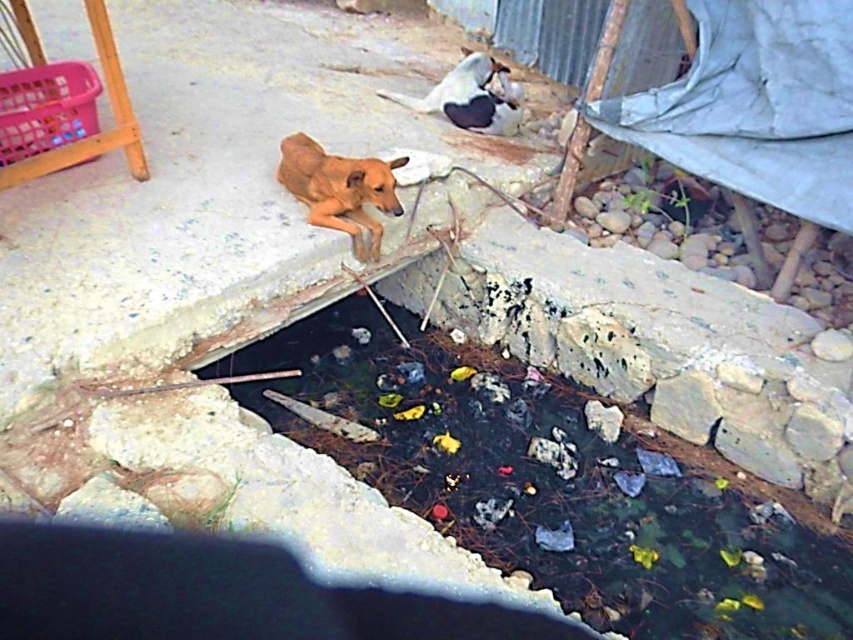
Consider the image. Which is more to the left, black stone puddle at center or brown furry dog at center?

Positioned to the left is brown furry dog at center.

How much distance is there between black stone puddle at center and brown furry dog at center?

They are 3.86 feet apart.

Measure the distance between black stone puddle at center and camera.

black stone puddle at center is 9.15 feet away from camera.

Where is `black stone puddle at center`? The height and width of the screenshot is (640, 853). black stone puddle at center is located at coordinates (548, 481).

Who is lower down, brown furry dog at center or white fur dog at upper center?

brown furry dog at center is below.

Between brown furry dog at center and white fur dog at upper center, which one appears on the left side from the viewer's perspective?

brown furry dog at center is more to the left.

This screenshot has width=853, height=640. What do you see at coordinates (339, 189) in the screenshot?
I see `brown furry dog at center` at bounding box center [339, 189].

Where is `brown furry dog at center`? brown furry dog at center is located at coordinates (339, 189).

Between point (799, 632) and point (495, 74), which one is positioned behind?

Point (495, 74)

Can you confirm if black stone puddle at center is smaller than white fur dog at upper center?

Incorrect, black stone puddle at center is not smaller in size than white fur dog at upper center.

What do you see at coordinates (548, 481) in the screenshot?
I see `black stone puddle at center` at bounding box center [548, 481].

Locate an element on the screen. The image size is (853, 640). black stone puddle at center is located at coordinates (548, 481).